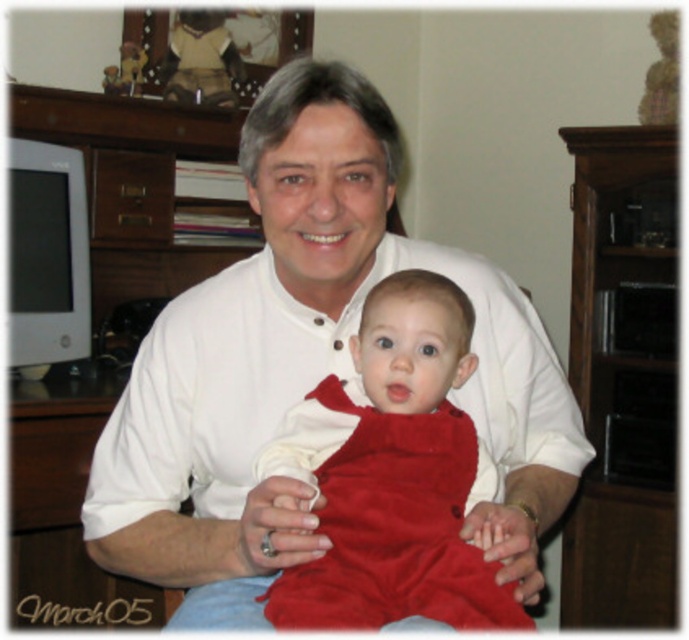
At what (x,y) coordinates should I click in order to perform the action: click on white smooth shirt at center. Please return your answer as a coordinate pair (x, y). This screenshot has height=640, width=689. Looking at the image, I should click on (308, 369).

Identify the location of white smooth shirt at center. (308, 369).